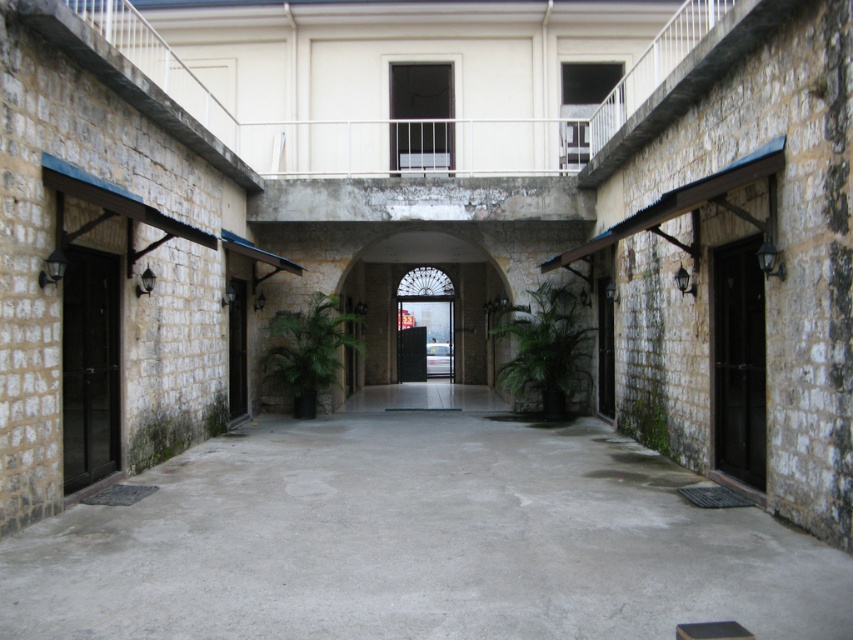
You are standing in the courtyard and want to take a photo of the smooth stone archway at center and the black glass door at right. Which object should you focus on first if you want to capture both in a single frame without moving the camera?

You should focus on the smooth stone archway at center first because it is taller than the black glass door at right, so it will occupy more vertical space in the frame.

In the scene shown: You are standing in the courtyard and want to enter the building through the black glass door at right. The smooth stone archway at center is blocking your path. Can you walk under the archway to reach the door?

The smooth stone archway at center is above the black glass door at right, so you can walk under the archway to reach the door.